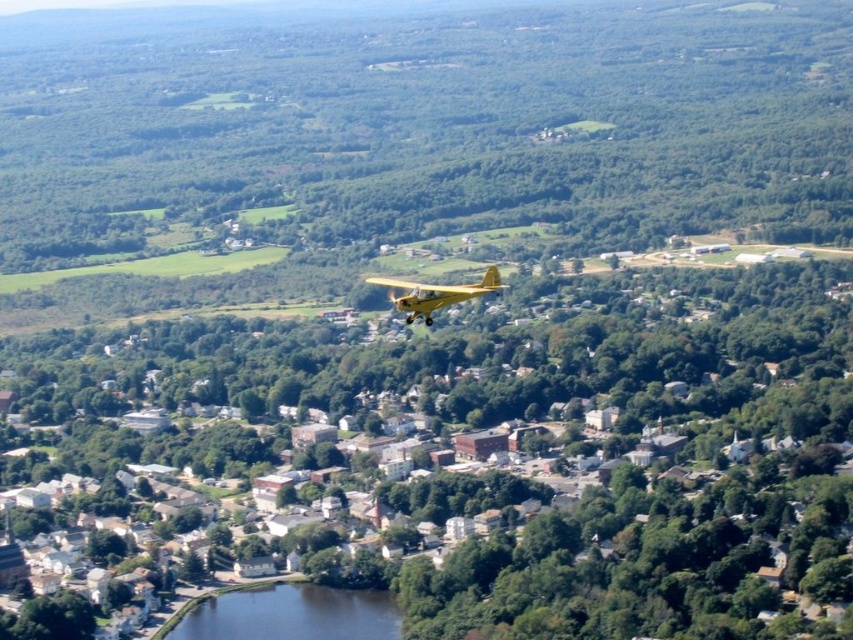
You are a drone operator trying to capture a photo of the yellow matte airplane at center and the dark blue water at lower center. Which object should you focus on first if you want to take a photo that includes both in the same frame without adjusting your camera angle?

The dark blue water at lower center is further to the viewer than the yellow matte airplane at center, so you should focus on the dark blue water at lower center first to ensure both are in the frame.

You are a photographer taking an aerial photo of the town. You want to focus on both the point at coordinates point (242,608) and point (437,284). Which point is closer to your camera lens?

Point (437,284) is closer to the camera lens because it is less further than point (242,608).

You are a pilot flying the yellow matte airplane at center and need to land on the dark blue water at lower center. Is the airplane currently positioned above the landing zone?

The dark blue water at lower center is positioned under the yellow matte airplane at center, so yes, the airplane is currently above the landing zone.